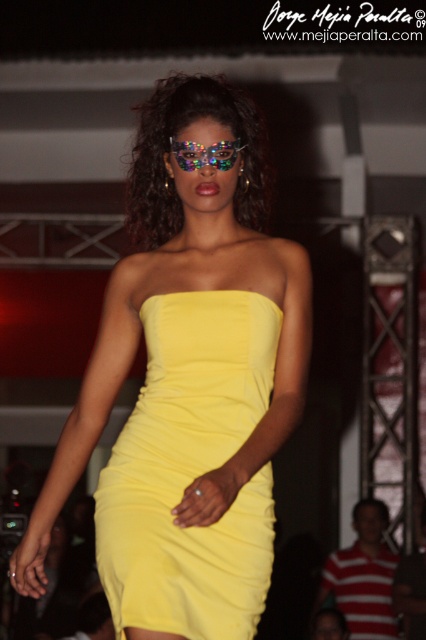
Question: Among these points, which one is farthest from the camera?

Choices:
 (A) (235, 148)
 (B) (252, 636)
 (C) (54, 461)

Answer: (C)

Question: Can you confirm if yellow matte dress at center is bigger than yellow satin dress at center?

Choices:
 (A) yes
 (B) no

Answer: (A)

Question: Among these points, which one is farthest from the camera?

Choices:
 (A) (196, 436)
 (B) (178, 356)
 (C) (213, 148)

Answer: (B)

Question: Among these points, which one is nearest to the camera?

Choices:
 (A) (163, 518)
 (B) (242, 412)

Answer: (A)

Question: Can you confirm if yellow satin dress at center is thinner than holographic plastic goggles at center?

Choices:
 (A) yes
 (B) no

Answer: (B)

Question: Is the position of yellow matte dress at center less distant than that of yellow satin dress at center?

Choices:
 (A) yes
 (B) no

Answer: (B)